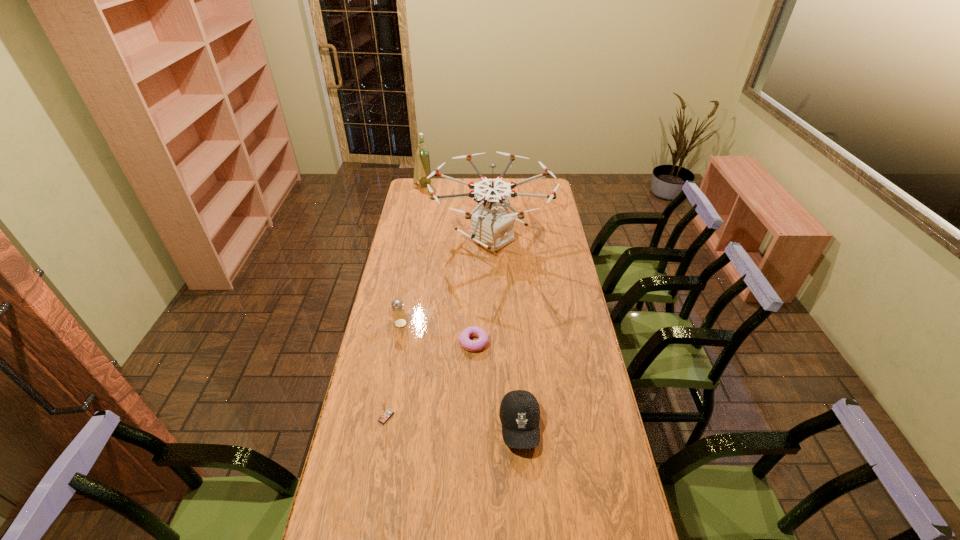
Find the location of a particular element. This screenshot has height=540, width=960. free space located on the front-facing side of the fifth shortest object is located at coordinates (475, 186).

Where is `free space located 0.190m on the front of the third farthest object`? This screenshot has width=960, height=540. free space located 0.190m on the front of the third farthest object is located at coordinates (392, 368).

Locate an element on the screen. free spot located on the front-facing side of the baseball cap is located at coordinates (527, 527).

You are a GUI agent. You are given a task and a screenshot of the screen. Output one action in this format:
    pyautogui.click(x=<x>, y=<y>)
    Task: Click on the vacant area located on the back of the matchbox
    
    Given the screenshot: What is the action you would take?
    pyautogui.click(x=394, y=374)

Find the location of a particular element. The image size is (960, 540). blank space located 0.190m on the back of the third nearest object is located at coordinates (475, 298).

Identify the location of object located at the far edge. The width and height of the screenshot is (960, 540). (422, 169).

At what (x,y) coordinates should I click in order to perform the action: click on wine bottle that is at the left edge. Please return your answer as a coordinate pair (x, y). Looking at the image, I should click on (422, 169).

Identify the location of saltshaker at the left edge. (399, 316).

This screenshot has width=960, height=540. What are the coordinates of `matchbox located in the left edge section of the desktop` in the screenshot? It's located at (386, 413).

This screenshot has height=540, width=960. Identify the location of object at the right edge. (491, 226).